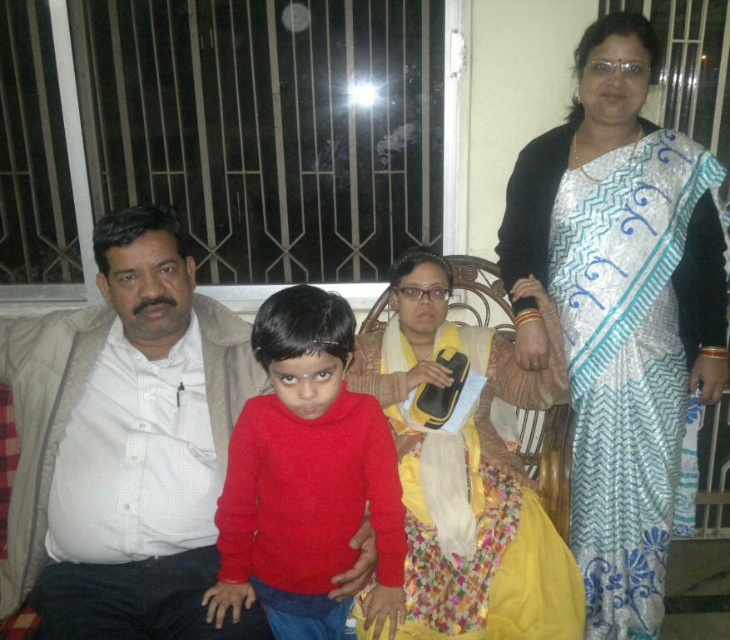
Question: Where is silver metallic saree at upper right located in relation to yellow satin dress at center in the image?

Choices:
 (A) right
 (B) left

Answer: (A)

Question: Among these objects, which one is farthest from the camera?

Choices:
 (A) silver metallic saree at upper right
 (B) matte red sweater at center
 (C) yellow satin dress at center

Answer: (A)

Question: Which of the following is the farthest from the observer?

Choices:
 (A) silver metallic saree at upper right
 (B) yellow satin dress at center
 (C) matte red sweater at center
 (D) white checkered shirt at left

Answer: (A)

Question: Estimate the real-world distances between objects in this image. Which object is closer to the matte red sweater at center?

Choices:
 (A) white checkered shirt at left
 (B) silver metallic saree at upper right

Answer: (A)

Question: Is matte red sweater at center in front of yellow satin dress at center?

Choices:
 (A) no
 (B) yes

Answer: (B)

Question: Can you confirm if white checkered shirt at left is positioned below matte red sweater at center?

Choices:
 (A) no
 (B) yes

Answer: (A)